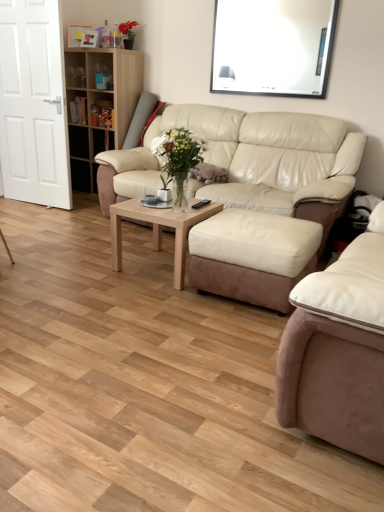
Identify the location of beige leather couch at center, which is the first studio couch in front-to-back order. (337, 358).

Describe the element at coordinates (273, 47) in the screenshot. I see `white glossy window screen at upper center` at that location.

Where is `light brown wood coffee table at center`? This screenshot has height=512, width=384. light brown wood coffee table at center is located at coordinates (159, 229).

Is the depth of wooden bookshelf at upper left less than that of beige leather couch at center, the 2th studio couch positioned from the front?

That is False.

Between wooden bookshelf at upper left and beige leather couch at center, the 2th studio couch positioned from the front, which one has smaller width?

With smaller width is wooden bookshelf at upper left.

From the image's perspective, is wooden bookshelf at upper left on beige leather couch at center, which is counted as the first studio couch, starting from the back?

Correct, wooden bookshelf at upper left appears higher than beige leather couch at center, which is counted as the first studio couch, starting from the back, in the image.

Is wooden bookshelf at upper left inside or outside of beige leather couch at center, which is counted as the first studio couch, starting from the back?

wooden bookshelf at upper left is outside beige leather couch at center, which is counted as the first studio couch, starting from the back.

From a real-world perspective, relative to white leather ottoman at center, is light brown wood coffee table at center vertically above or below?

light brown wood coffee table at center is below white leather ottoman at center.

In the image, is light brown wood coffee table at center positioned in front of or behind white leather ottoman at center?

light brown wood coffee table at center is positioned farther from the viewer than white leather ottoman at center.

Is light brown wood coffee table at center not near white leather ottoman at center?

No.

Is white glossy door at left positioned with its back to white leather ottoman at center?

No.

How many degrees apart are the facing directions of white glossy door at left and white leather ottoman at center?

There is a 5.06-degree angle between the facing directions of white glossy door at left and white leather ottoman at center.

Can you see white glossy door at left touching white leather ottoman at center?

No, white glossy door at left is not making contact with white leather ottoman at center.

From the picture: Considering the relative sizes of white glossy door at left and white leather ottoman at center in the image provided, is white glossy door at left taller than white leather ottoman at center?

Indeed, white glossy door at left has a greater height compared to white leather ottoman at center.

Considering the positions of objects white glossy door at left and wooden bookshelf at upper left in the image provided, who is more to the left, white glossy door at left or wooden bookshelf at upper left?

From the viewer's perspective, white glossy door at left appears more on the left side.

Is white glossy door at left bigger or smaller than wooden bookshelf at upper left?

white glossy door at left is smaller than wooden bookshelf at upper left.

Considering the sizes of white glossy door at left and wooden bookshelf at upper left in the image, is white glossy door at left wider or thinner than wooden bookshelf at upper left?

A: Considering their sizes, white glossy door at left looks slimmer than wooden bookshelf at upper left.

From a real-world perspective, is white glossy door at left physically located above or below wooden bookshelf at upper left?

white glossy door at left is situated higher than wooden bookshelf at upper left in the real world.

Is white leather ottoman at center positioned beyond the bounds of beige leather couch at center, the second studio couch viewed from the back?

Yes.

Can you confirm if white leather ottoman at center is positioned to the left of beige leather couch at center, which is the first studio couch in front-to-back order?

Yes.

From a real-world perspective, is white leather ottoman at center physically located above or below beige leather couch at center, which is the first studio couch in front-to-back order?

white leather ottoman at center is below beige leather couch at center, which is the first studio couch in front-to-back order.

From a real-world perspective, which object rests below the other?

light brown wood coffee table at center is physically lower.

Is point (91, 63) positioned before point (135, 213)?

No, it is behind (135, 213).

How many degrees apart are the facing directions of wooden bookshelf at upper left and light brown wood coffee table at center?

wooden bookshelf at upper left and light brown wood coffee table at center are facing 1.72 degrees away from each other.

Between wooden bookshelf at upper left and light brown wood coffee table at center, which one has smaller size?

light brown wood coffee table at center.

Based on their positions, is white leather ottoman at center located to the left or right of white glossy window screen at upper center?

In the image, white leather ottoman at center appears on the left side of white glossy window screen at upper center.

Who is bigger, white leather ottoman at center or white glossy window screen at upper center?

With larger size is white leather ottoman at center.

Between point (273, 293) and point (301, 14), which one is positioned behind?

The point (301, 14) is farther.

Would you say white leather ottoman at center is a long distance from white glossy window screen at upper center?

white leather ottoman at center is positioned a significant distance from white glossy window screen at upper center.

The width and height of the screenshot is (384, 512). Identify the location of dresser on the left of the beige leather couch at center, which is counted as the first studio couch, starting from the back. (99, 106).

The height and width of the screenshot is (512, 384). I want to click on stool in front of the light brown wood coffee table at center, so click(252, 256).

Considering their positions, is beige leather couch at center, the 2th studio couch positioned from the front, positioned further to white glossy door at left than light brown wood coffee table at center?

light brown wood coffee table at center lies further to white glossy door at left than the other object.

When comparing their distances from white glossy door at left, does beige leather couch at center, which is the first studio couch in front-to-back order, or beige leather couch at center, which is counted as the first studio couch, starting from the back, seem further?

Based on the image, beige leather couch at center, which is the first studio couch in front-to-back order, appears to be further to white glossy door at left.

Looking at the image, which one is located closer to beige leather couch at center, the 2th studio couch positioned from the front, white leather ottoman at center or beige leather couch at center, which is the first studio couch in front-to-back order?

white leather ottoman at center lies closer to beige leather couch at center, the 2th studio couch positioned from the front, than the other object.

From the picture: Looking at the image, which one is located closer to light brown wood coffee table at center, beige leather couch at center, the 2th studio couch positioned from the front, or white glossy door at left?

beige leather couch at center, the 2th studio couch positioned from the front, lies closer to light brown wood coffee table at center than the other object.

Which object lies nearer to the anchor point white leather ottoman at center, white glossy door at left or light brown wood coffee table at center?

light brown wood coffee table at center.

Which object lies nearer to the anchor point wooden bookshelf at upper left, white glossy window screen at upper center or beige leather couch at center, which is counted as the first studio couch, starting from the back?

Among the two, beige leather couch at center, which is counted as the first studio couch, starting from the back, is located nearer to wooden bookshelf at upper left.

Based on their spatial positions, is light brown wood coffee table at center or wooden bookshelf at upper left closer to white glossy window screen at upper center?

The object closer to white glossy window screen at upper center is wooden bookshelf at upper left.

Looking at the image, which one is located further to white leather ottoman at center, white glossy window screen at upper center or beige leather couch at center, the second studio couch viewed from the back?

white glossy window screen at upper center is positioned further to the anchor white leather ottoman at center.

Locate an element on the screen. coffee table positioned between beige leather couch at center, the second studio couch viewed from the back, and white glossy window screen at upper center from near to far is located at coordinates (x=159, y=229).

At what (x,y) coordinates should I click in order to perform the action: click on coffee table that lies between beige leather couch at center, the 2th studio couch positioned from the front, and white leather ottoman at center from top to bottom. Please return your answer as a coordinate pair (x, y). This screenshot has height=512, width=384. Looking at the image, I should click on (159, 229).

The height and width of the screenshot is (512, 384). In order to click on studio couch between white glossy door at left and white leather ottoman at center from left to right in this screenshot , I will do `click(250, 162)`.

Where is `studio couch between beige leather couch at center, which is the first studio couch in front-to-back order, and white glossy door at left from front to back`? The image size is (384, 512). studio couch between beige leather couch at center, which is the first studio couch in front-to-back order, and white glossy door at left from front to back is located at coordinates (250, 162).